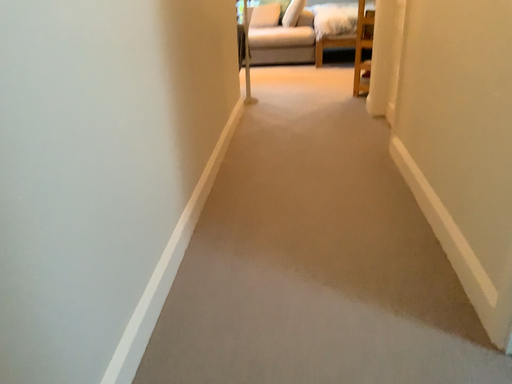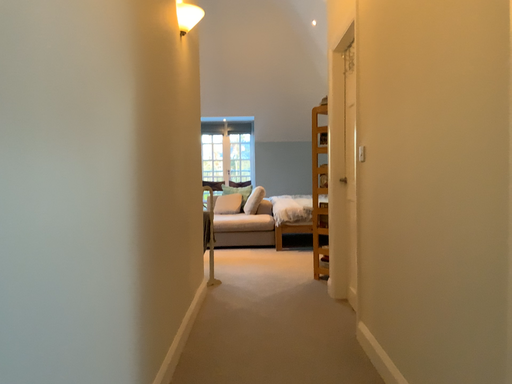
Question: Which way did the camera rotate in the video?

Choices:
 (A) rotated downward
 (B) rotated upward

Answer: (B)